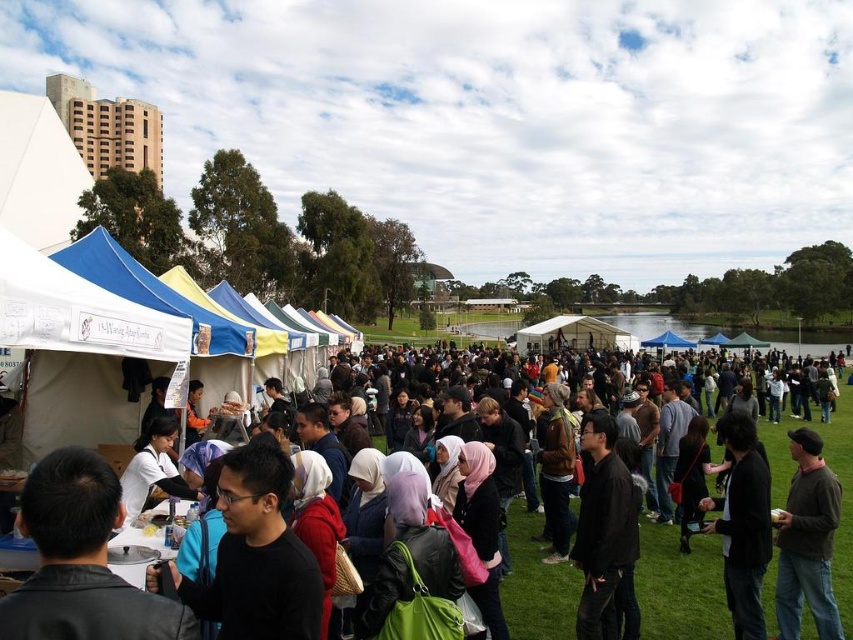
Where is the brown leather jacket at lower right located in the image?

The brown leather jacket at lower right is located at point (807,541) in the image.

You are organizing a photo shoot and need to place two jackets on a shelf. The shelf has limited space. Given the jackets are the brown leather jacket at lower right and the black leather jacket at lower right, which jacket should you choose to fit on the shelf if the shelf can only accommodate the narrower one?

The black leather jacket at lower right should be chosen because it is narrower than the brown leather jacket at lower right, which is wider and may not fit on the shelf.